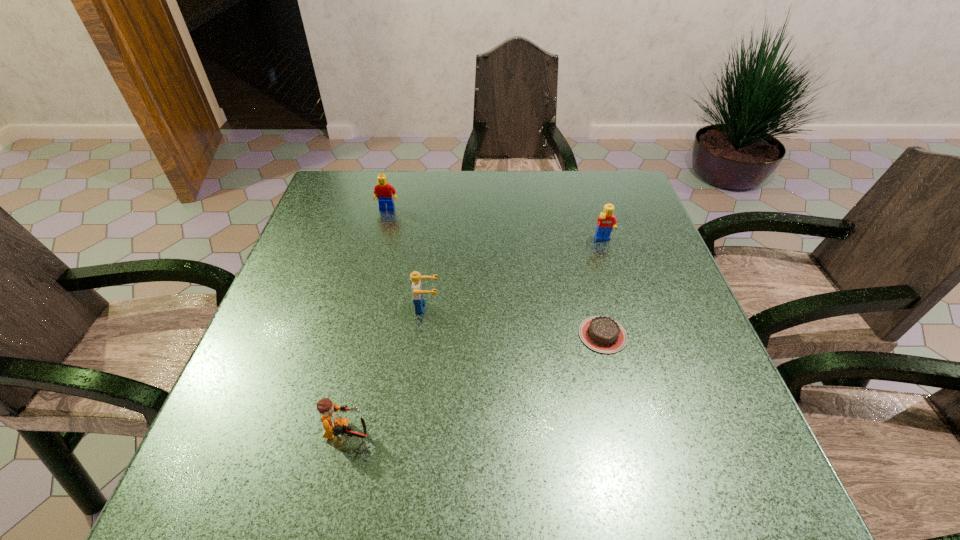
Identify the location of the farthest Lego. (383, 191).

The height and width of the screenshot is (540, 960). Identify the location of the fourth nearest object. (607, 221).

Identify the location of the second farthest Lego. (607, 221).

This screenshot has width=960, height=540. I want to click on the second Lego from right to left, so click(417, 290).

Find the location of a particular element. the third farthest object is located at coordinates (417, 290).

Where is `the nearest object`? The height and width of the screenshot is (540, 960). the nearest object is located at coordinates (334, 425).

The height and width of the screenshot is (540, 960). Identify the location of chocolate cake. (602, 334).

The height and width of the screenshot is (540, 960). I want to click on the second nearest object, so click(602, 334).

Locate an element on the screen. vacant space located on the front-facing side of the farthest object is located at coordinates (379, 241).

Locate an element on the screen. This screenshot has height=540, width=960. vacant space situated 0.270m on the face of the rightmost Lego is located at coordinates (631, 328).